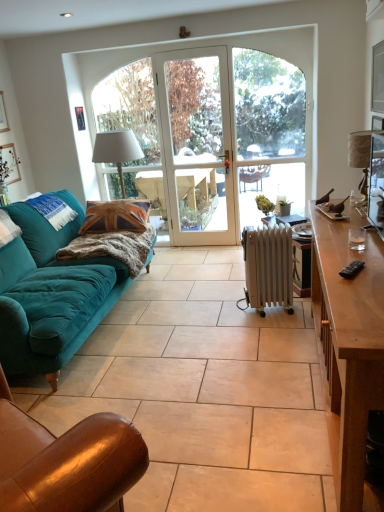
Question: From a real-world perspective, does brown leather chair at lower left stand above brown wooden desk at right?

Choices:
 (A) yes
 (B) no

Answer: (A)

Question: From a real-world perspective, does brown leather chair at lower left sit lower than brown wooden desk at right?

Choices:
 (A) yes
 (B) no

Answer: (B)

Question: Would you say brown wooden desk at right is part of brown leather chair at lower left's contents?

Choices:
 (A) no
 (B) yes

Answer: (A)

Question: Does brown leather chair at lower left have a greater width compared to brown wooden desk at right?

Choices:
 (A) yes
 (B) no

Answer: (B)

Question: Considering the relative sizes of brown leather chair at lower left and brown wooden desk at right in the image provided, is brown leather chair at lower left smaller than brown wooden desk at right?

Choices:
 (A) yes
 (B) no

Answer: (A)

Question: From the image's perspective, is brown leather chair at lower left located beneath brown wooden desk at right?

Choices:
 (A) yes
 (B) no

Answer: (A)

Question: Does white glass screen door at center appear on the left side of brown leather chair at lower left?

Choices:
 (A) no
 (B) yes

Answer: (A)

Question: From a real-world perspective, is white glass screen door at center below brown leather chair at lower left?

Choices:
 (A) yes
 (B) no

Answer: (B)

Question: Can you confirm if white glass screen door at center is smaller than brown leather chair at lower left?

Choices:
 (A) no
 (B) yes

Answer: (B)

Question: Is white glass screen door at center far from brown leather chair at lower left?

Choices:
 (A) no
 (B) yes

Answer: (B)

Question: From the image's perspective, is white glass screen door at center under brown leather chair at lower left?

Choices:
 (A) yes
 (B) no

Answer: (B)

Question: Does white glass screen door at center have a lesser height compared to brown leather chair at lower left?

Choices:
 (A) yes
 (B) no

Answer: (B)

Question: Can you confirm if teal velvet pillow at left is taller than white fabric lampshade at center, which is counted as the second lamp, starting from the front?

Choices:
 (A) yes
 (B) no

Answer: (B)